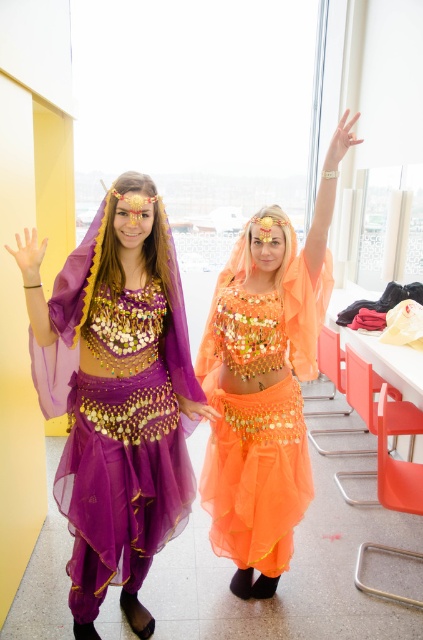
You are a photographer positioned in front of the two belly dancers. You need to capture a photo where both the matte purple fabric at left and the orange sheer fabric belly dancer at center are clearly visible. Which one should you focus on first to ensure both are in focus?

You should focus on the matte purple fabric at left first because it is closer to you than the orange sheer fabric belly dancer at center, so focusing on the closer object will help both be in focus.

You are a photographer setting up a shoot in the studio. You have a spotlight that can only illuminate a circular area with a radius of 0.2 units. The center of the spotlight must be placed exactly at point (x=118, y=396). Will the spotlight cover the entire matte purple fabric at left?

The point (x=118, y=396) corresponds to the matte purple fabric at left. Since the spotlight is centered at this point with a radius of 0.2 units, it will illuminate the area around the matte purple fabric at left. However, without knowing the dimensions of the matte purple fabric at left, we cannot confirm if the entire fabric is covered.